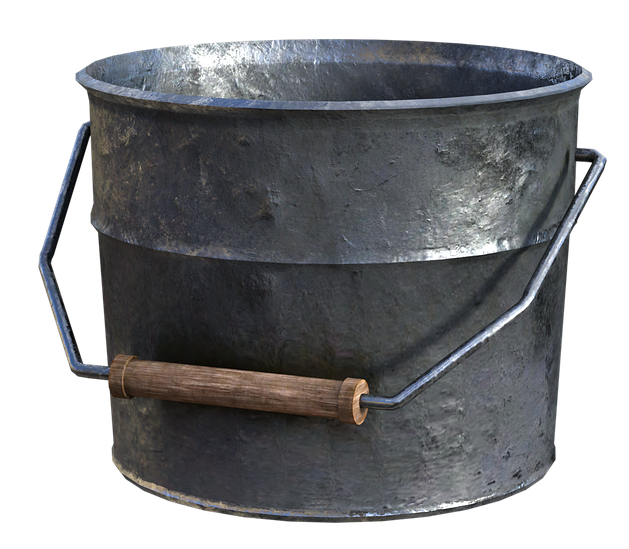
Where is `circular ends of wooden handle`? circular ends of wooden handle is located at coordinates (347, 389), (114, 369).